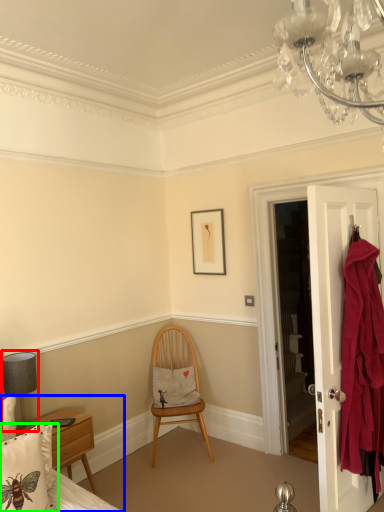
Question: Which object is the closest to the lamp (highlighted by a red box)? Choose among these: bed (highlighted by a blue box) or pillow (highlighted by a green box).

Choices:
 (A) bed
 (B) pillow

Answer: (A)